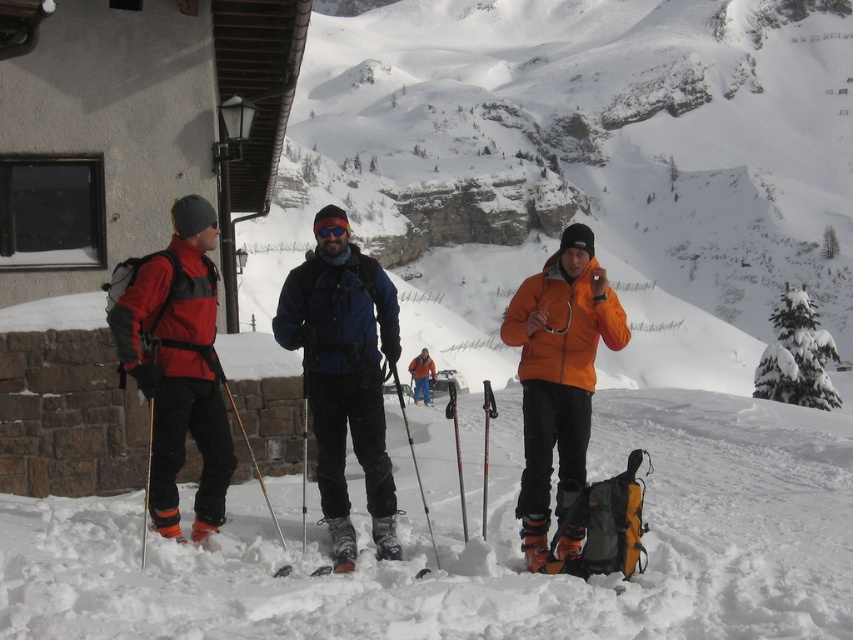
Which is above, blue matte jacket at center or silver metallic ski pole at center?

blue matte jacket at center is higher up.

Who is positioned more to the left, blue matte jacket at center or silver metallic ski pole at center?

From the viewer's perspective, blue matte jacket at center appears more on the left side.

Does point (316, 438) come closer to viewer compared to point (408, 440)?

Yes, point (316, 438) is in front of point (408, 440).

Find the location of a particular element. blue matte jacket at center is located at coordinates (344, 380).

Can you confirm if matte red jacket at left is positioned above silver metallic ski pole at center?

Indeed, matte red jacket at left is positioned over silver metallic ski pole at center.

Locate an element on the screen. matte red jacket at left is located at coordinates (178, 364).

Where is `matte red jacket at left`? The image size is (853, 640). matte red jacket at left is located at coordinates (178, 364).

How far apart are orange matte jacket at center and blue reflective lens goggles at center?

The distance of orange matte jacket at center from blue reflective lens goggles at center is 43.31 meters.

Who is taller, orange matte jacket at center or blue reflective lens goggles at center?

With more height is orange matte jacket at center.

At what (x,y) coordinates should I click in order to perform the action: click on orange matte jacket at center. Please return your answer as a coordinate pair (x, y). This screenshot has width=853, height=640. Looking at the image, I should click on 422,376.

Image resolution: width=853 pixels, height=640 pixels. In order to click on orange matte jacket at center in this screenshot , I will do (422, 376).